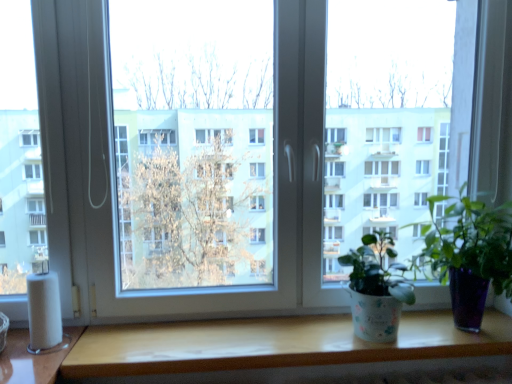
Question: From a real-world perspective, is white textured pot at center, the 2th houseplant from the right, positioned under green glossy plant at center, positioned as the 1th houseplant in right-to-left order, based on gravity?

Choices:
 (A) yes
 (B) no

Answer: (A)

Question: Is white textured pot at center, the 2th houseplant from the right, in contact with green glossy plant at center, which is the second houseplant in left-to-right order?

Choices:
 (A) yes
 (B) no

Answer: (B)

Question: From the image's perspective, is white textured pot at center, which ranks as the first houseplant in left-to-right order, under green glossy plant at center, which is the second houseplant in left-to-right order?

Choices:
 (A) no
 (B) yes

Answer: (B)

Question: Can you confirm if white textured pot at center, which ranks as the first houseplant in left-to-right order, is thinner than green glossy plant at center, which is the second houseplant in left-to-right order?

Choices:
 (A) no
 (B) yes

Answer: (B)

Question: Considering the relative sizes of white textured pot at center, the 2th houseplant from the right, and green glossy plant at center, which is the second houseplant in left-to-right order, in the image provided, is white textured pot at center, the 2th houseplant from the right, smaller than green glossy plant at center, which is the second houseplant in left-to-right order,?

Choices:
 (A) no
 (B) yes

Answer: (B)

Question: Is white textured pot at center, which ranks as the first houseplant in left-to-right order, at the right side of green glossy plant at center, which is the second houseplant in left-to-right order?

Choices:
 (A) no
 (B) yes

Answer: (A)

Question: Is the depth of green glossy plant at center, positioned as the 1th houseplant in right-to-left order, less than that of wooden table at lower center?

Choices:
 (A) yes
 (B) no

Answer: (A)

Question: Does green glossy plant at center, which is the second houseplant in left-to-right order, appear on the right side of wooden table at lower center?

Choices:
 (A) yes
 (B) no

Answer: (A)

Question: From the image's perspective, would you say green glossy plant at center, positioned as the 1th houseplant in right-to-left order, is shown under wooden table at lower center?

Choices:
 (A) no
 (B) yes

Answer: (A)

Question: Is green glossy plant at center, which is the second houseplant in left-to-right order, facing towards wooden table at lower center?

Choices:
 (A) yes
 (B) no

Answer: (B)

Question: From a real-world perspective, is green glossy plant at center, positioned as the 1th houseplant in right-to-left order, beneath wooden table at lower center?

Choices:
 (A) yes
 (B) no

Answer: (B)

Question: Does green glossy plant at center, positioned as the 1th houseplant in right-to-left order, have a lesser height compared to wooden table at lower center?

Choices:
 (A) yes
 (B) no

Answer: (B)

Question: Is green glossy plant at center, positioned as the 1th houseplant in right-to-left order, looking in the opposite direction of white matte toilet paper at lower left?

Choices:
 (A) no
 (B) yes

Answer: (A)